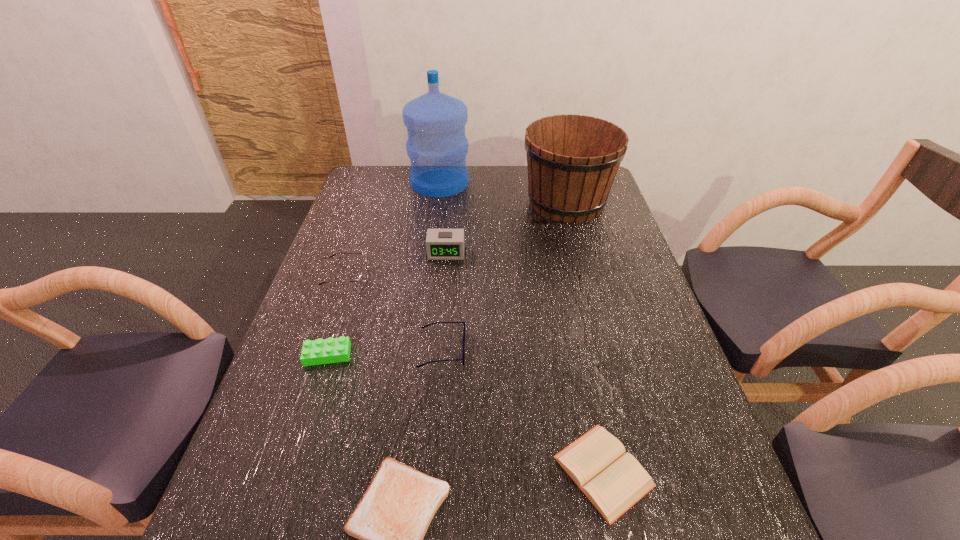
Where is `free region located on the left of the wine bucket`? The image size is (960, 540). free region located on the left of the wine bucket is located at coordinates (477, 202).

Identify the location of blank space located 0.250m on the front-facing side of the third tallest object. This screenshot has height=540, width=960. (440, 323).

Image resolution: width=960 pixels, height=540 pixels. I want to click on blank space located 0.380m on the front-facing side of the farther spectacles, so click(502, 276).

I want to click on free space located on the front-facing side of the nearer spectacles, so click(498, 349).

This screenshot has height=540, width=960. I want to click on free space located 0.200m on the front of the Lego, so click(298, 449).

Where is `free region located 0.400m on the back of the second shortest object`? Image resolution: width=960 pixels, height=540 pixels. free region located 0.400m on the back of the second shortest object is located at coordinates (566, 291).

Find the location of a particular element. water jug positioned at the far edge is located at coordinates (437, 146).

You are a GUI agent. You are given a task and a screenshot of the screen. Output one action in this format:
    pyautogui.click(x=<x>, y=<y>)
    Task: Click on the wine bucket that is at the far edge
    The height and width of the screenshot is (540, 960).
    Given the screenshot: What is the action you would take?
    pyautogui.click(x=572, y=160)

Find the location of a particular element. spectacles positioned at the left edge is located at coordinates (362, 278).

Locate an element on the screen. The image size is (960, 540). Lego that is at the left edge is located at coordinates (331, 350).